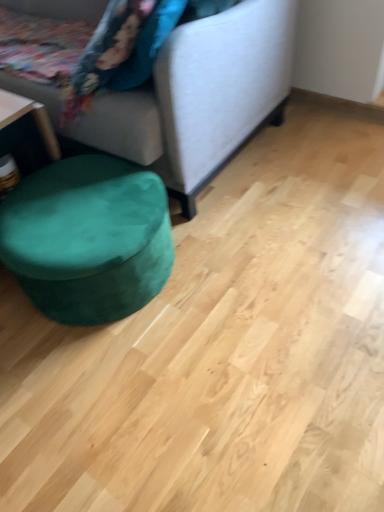
Question: Based on their sizes in the image, would you say velvet fabric studio couch at lower left is bigger or smaller than velvet green ottoman at lower left?

Choices:
 (A) big
 (B) small

Answer: (A)

Question: Would you say velvet fabric studio couch at lower left is inside or outside velvet green ottoman at lower left?

Choices:
 (A) outside
 (B) inside

Answer: (A)

Question: Does point (220, 143) appear closer or farther from the camera than point (127, 187)?

Choices:
 (A) closer
 (B) farther

Answer: (B)

Question: Visually, is velvet green ottoman at lower left positioned to the left or to the right of velvet fabric studio couch at lower left?

Choices:
 (A) right
 (B) left

Answer: (A)

Question: Is velvet green ottoman at lower left in front of or behind velvet fabric studio couch at lower left in the image?

Choices:
 (A) front
 (B) behind

Answer: (B)

Question: From a real-world perspective, is velvet green ottoman at lower left positioned above or below velvet fabric studio couch at lower left?

Choices:
 (A) below
 (B) above

Answer: (A)

Question: Does point (64, 164) appear closer or farther from the camera than point (162, 73)?

Choices:
 (A) closer
 (B) farther

Answer: (B)